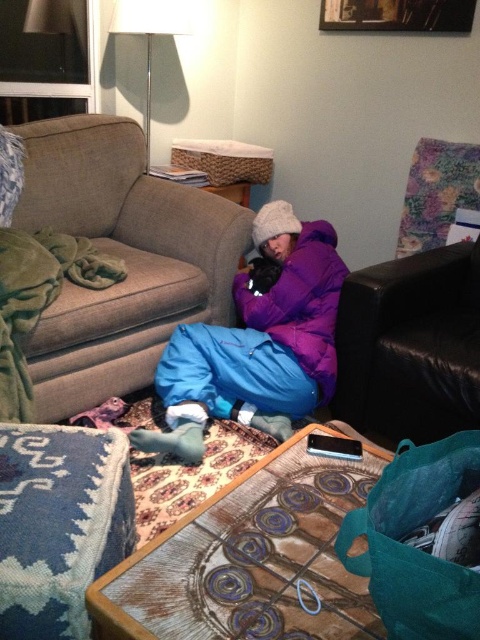
Question: Which object is farther from the camera taking this photo?

Choices:
 (A) beige fabric couch at center
 (B) white fabric lampshade at upper center
 (C) teal fabric sleeping bag at lower right

Answer: (B)

Question: Which object is the farthest from the teal fabric sleeping bag at lower right?

Choices:
 (A) black leather couch at right
 (B) purple down jacket at center

Answer: (B)

Question: Is black leather couch at right wider than white fabric lampshade at upper center?

Choices:
 (A) no
 (B) yes

Answer: (B)

Question: Which object appears closest to the camera in this image?

Choices:
 (A) teal fabric sleeping bag at lower right
 (B) black leather couch at right
 (C) white fabric lampshade at upper center
 (D) purple down jacket at center

Answer: (A)

Question: Where is beige fabric couch at center located in relation to teal fabric sleeping bag at lower right in the image?

Choices:
 (A) above
 (B) below

Answer: (A)

Question: Is teal fabric sleeping bag at lower right smaller than white fabric lampshade at upper center?

Choices:
 (A) no
 (B) yes

Answer: (B)